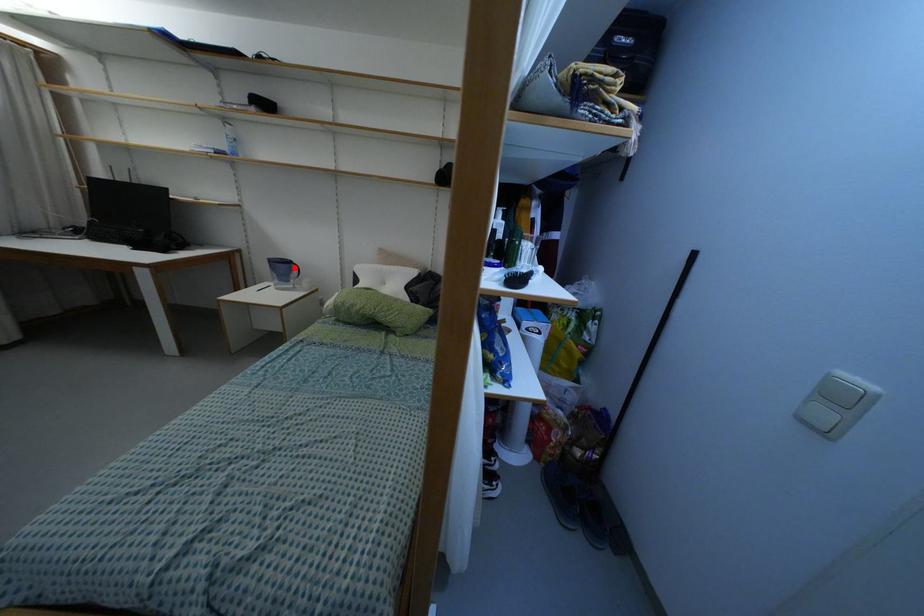
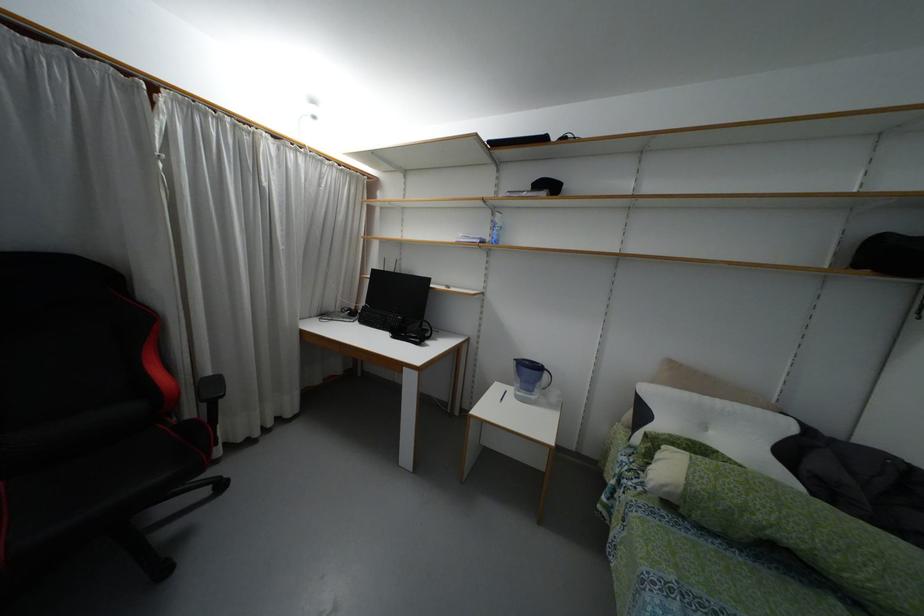
Question: I am providing you with two images of the same scene from different viewpoints. In image1, a red point is highlighted. Considering the same 3D point in image2, which of the following is correct?

Choices:
 (A) It is closer
 (B) It is farther

Answer: (B)